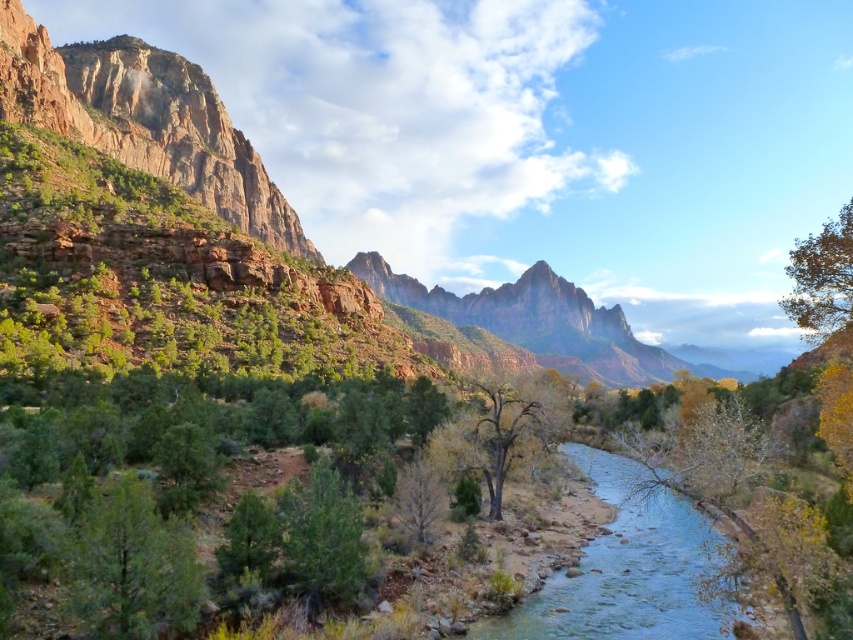
You are a hiker standing at the edge of the canyon and want to take a photo of the clear blue water at center and the green leafy tree at upper right. Which object should you frame first in your camera to ensure both are in the shot?

You should frame the clear blue water at center first because it is positioned on the left side of the green leafy tree at upper right, so starting with the leftmost object ensures both are included in the shot.

From the picture: You are standing at the point marked by the coordinates point (x=132, y=566) in the image. Looking around, what object is located at your current position?

The point (x=132, y=566) corresponds to the green matte tree at lower left.

You are a hiker standing at the edge of the river and want to take a photo of both the green matte tree at lower left and the brown textured tree at center in the same frame. Which tree should you position closer to the camera to ensure both are fully visible?

To include both the green matte tree at lower left and the brown textured tree at center in the same frame, position the green matte tree at lower left closer to the camera since it is shorter than the brown textured tree at center.